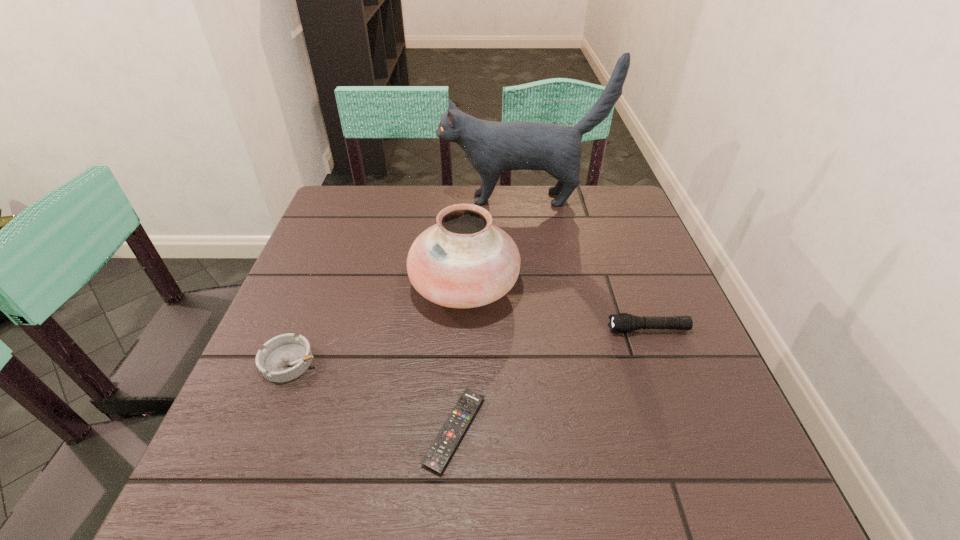
The height and width of the screenshot is (540, 960). What are the coordinates of `vacant point located 0.320m at the face of the tallest object` in the screenshot? It's located at 331,199.

At what (x,y) coordinates should I click in order to perform the action: click on free region located on the back of the pottery. Please return your answer as a coordinate pair (x, y). This screenshot has height=540, width=960. Looking at the image, I should click on (468, 222).

You are a GUI agent. You are given a task and a screenshot of the screen. Output one action in this format:
    pyautogui.click(x=<x>, y=<y>)
    Task: Click on the vacant region located at the lens end of the flashlight
    
    Given the screenshot: What is the action you would take?
    pyautogui.click(x=546, y=329)

At what (x,y) coordinates should I click in order to perform the action: click on vacant space positioned 0.160m at the lens end of the flashlight. Please return your answer as a coordinate pair (x, y). Looking at the image, I should click on (532, 329).

Identify the location of vacant area situated at the lens end of the flashlight. The height and width of the screenshot is (540, 960). (465, 329).

Identify the location of vacant region located on the front of the second shortest object. The width and height of the screenshot is (960, 540). (270, 412).

Identify the location of vacant space located on the right of the nearest object. 679,430.

Find the location of a particular element. The image size is (960, 540). object that is positioned at the far edge is located at coordinates (492, 147).

This screenshot has height=540, width=960. I want to click on object that is at the near edge, so click(x=440, y=451).

Where is `object at the left edge`? The image size is (960, 540). object at the left edge is located at coordinates (285, 357).